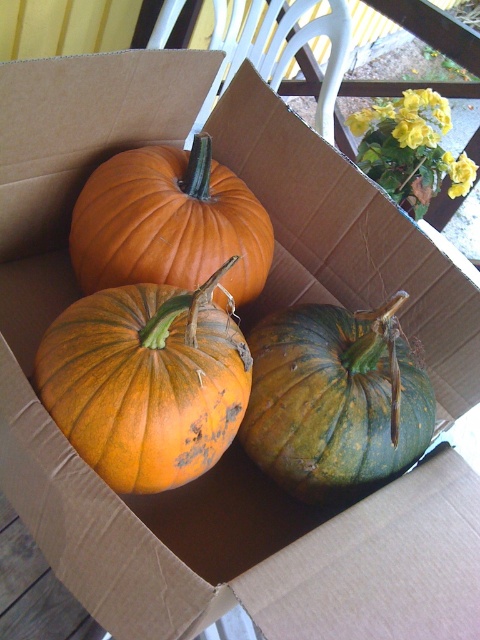
Question: Does green matte pumpkin at center appear on the right side of orange matte pumpkin at upper left?

Choices:
 (A) yes
 (B) no

Answer: (A)

Question: Based on their relative distances, which object is farther from the green matte pumpkin at center?

Choices:
 (A) orange matte pumpkin at center
 (B) orange matte pumpkin at upper left

Answer: (B)

Question: Is orange matte pumpkin at center below green matte pumpkin at center?

Choices:
 (A) no
 (B) yes

Answer: (A)

Question: Does orange matte pumpkin at center have a smaller size compared to green matte pumpkin at center?

Choices:
 (A) yes
 (B) no

Answer: (A)

Question: Which object is farther from the camera taking this photo?

Choices:
 (A) green matte pumpkin at center
 (B) orange matte pumpkin at upper left

Answer: (B)

Question: Which point is farther from the camera taking this photo?

Choices:
 (A) (310, 499)
 (B) (182, 209)

Answer: (B)